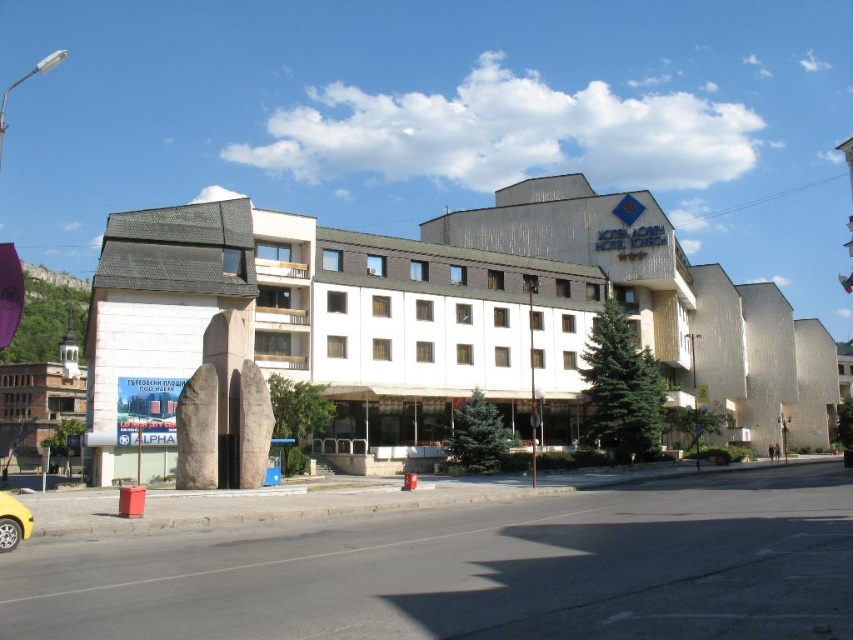
You are a pedestrian standing at the yellow matte taxi at lower left and want to enter the white concrete building at center. Which direction should you walk to reach the building?

Since the white concrete building at center is to the right of the yellow matte taxi at lower left, you should walk to your right to reach the building.

You are standing at the point marked by coordinates point (451,316). Based on the scene description, what structure are you currently positioned at?

The point (451,316) corresponds to the white concrete building at center, so you are positioned at the white concrete building at center.